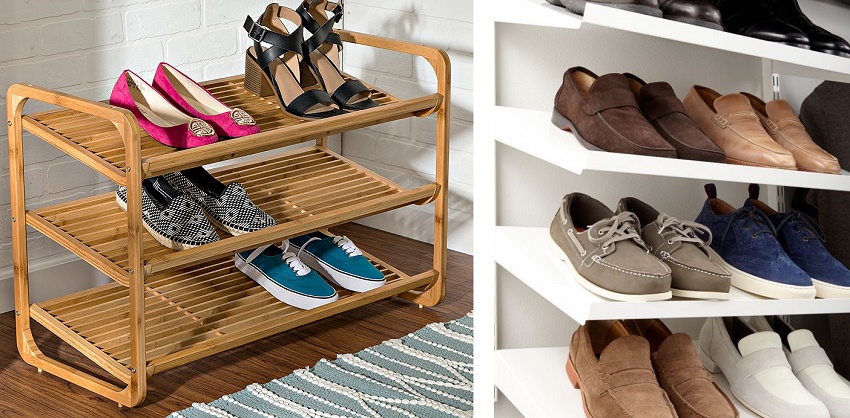
Image resolution: width=850 pixels, height=418 pixels. I want to click on shelf, so click(110, 144), click(99, 227), click(85, 318), click(524, 12), click(530, 138), click(529, 270), click(527, 394).